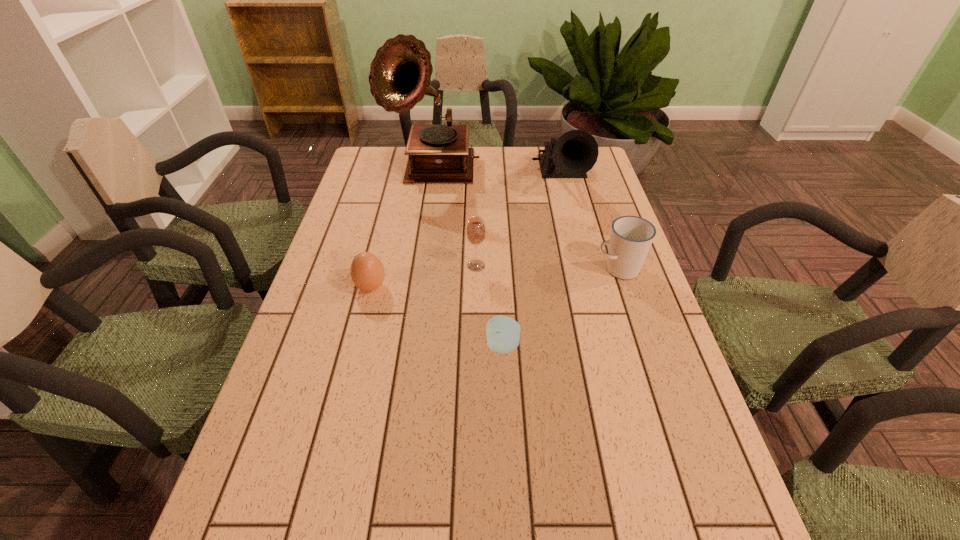
I want to click on vacant region between the nearest object and the second tallest object, so click(532, 263).

Identify the location of vacant area that lies between the wineglass and the record player. (454, 218).

The height and width of the screenshot is (540, 960). What are the coordinates of `vacant space in between the boiled egg and the nearest object` in the screenshot? It's located at (437, 316).

Locate an element on the screen. This screenshot has height=540, width=960. empty space between the tallest object and the cup is located at coordinates (525, 219).

At what (x,y) coordinates should I click in order to perform the action: click on object that is the third closest to the boiled egg. Please return your answer as a coordinate pair (x, y). Looking at the image, I should click on (400, 74).

You are a GUI agent. You are given a task and a screenshot of the screen. Output one action in this format:
    pyautogui.click(x=<x>, y=<y>)
    Task: Click on the object that is the fifth closest to the wineglass
    The image size is (960, 540).
    Given the screenshot: What is the action you would take?
    pyautogui.click(x=400, y=74)

The image size is (960, 540). What are the coordinates of `vacant area that satisfies the following two spatial constraints: 1. on the horn of the shortest object; 2. on the left side of the record player` in the screenshot? It's located at (406, 346).

The height and width of the screenshot is (540, 960). I want to click on vacant space that satisfies the following two spatial constraints: 1. on the horn of the record player; 2. on the left side of the wineglass, so click(x=419, y=266).